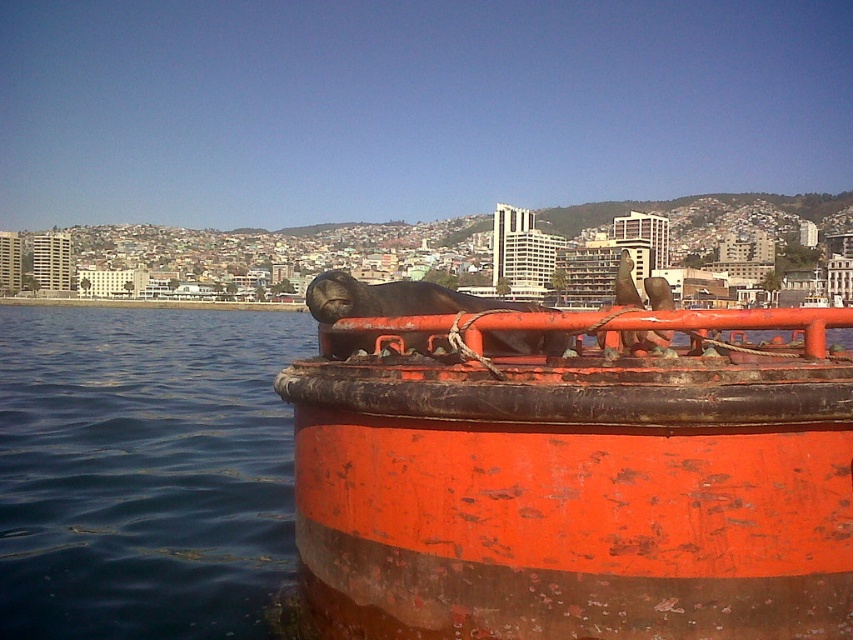
From the picture: You are standing on the deck of the boat and want to walk towards the city in the background. Which object, the blue water at lower left or the smooth orange rail at center, would you pass first?

The blue water at lower left would be passed first because the smooth orange rail at center is positioned behind it.

Consider the image. You are on a boat and see the rusty metal buoy at center and the smooth orange rail at center. Which object is closer to the left side of your view?

The rusty metal buoy at center is to the left of the smooth orange rail at center, so it is closer to the left side of your view.

You are a photographer trying to capture the rusty metal buoy at center in your shot. Based on its position, where should you aim your camera to ensure the buoy is centered in the frame?

To center the rusty metal buoy at center in your frame, aim your camera at the coordinates point (578,477), as that is the 2D location of the rusty metal buoy at center.